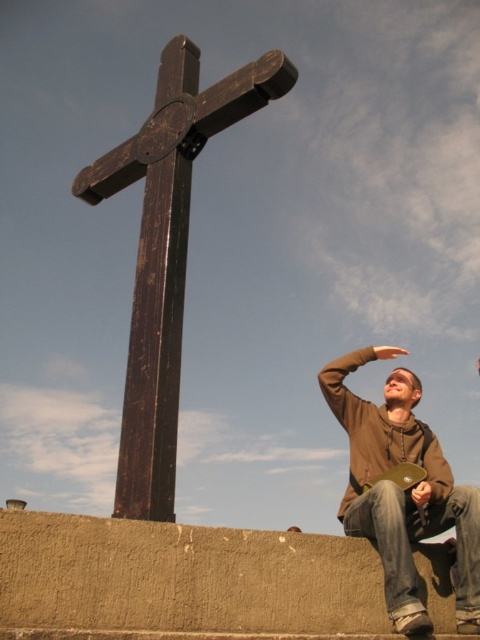
You are a photographer trying to capture both the dark wood cross at center and the brown hoodie at lower right in a single shot. Given their sizes, which object will appear bigger in your photo?

The dark wood cross at center will appear bigger in the photo because it has a larger size compared to the brown hoodie at lower right.

Consider the image. You are an architect designing a new park layout. The park will feature the dark wood cross at center and the brown hoodie at lower right as landmarks. If you want to place a bench equidistant between them, where should it be positioned based on their widths?

The dark wood cross at center is wider than the brown hoodie at lower right. To place a bench equidistant between them, position it closer to the dark wood cross at center since its greater width means it occupies more space, balancing the distance from both landmarks.